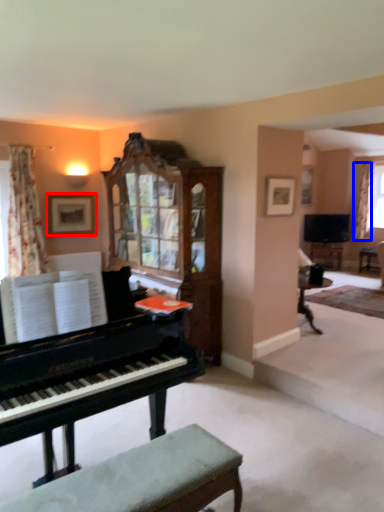
Question: Among these objects, which one is nearest to the camera, picture frame (highlighted by a red box) or curtain (highlighted by a blue box)?

Choices:
 (A) picture frame
 (B) curtain

Answer: (A)